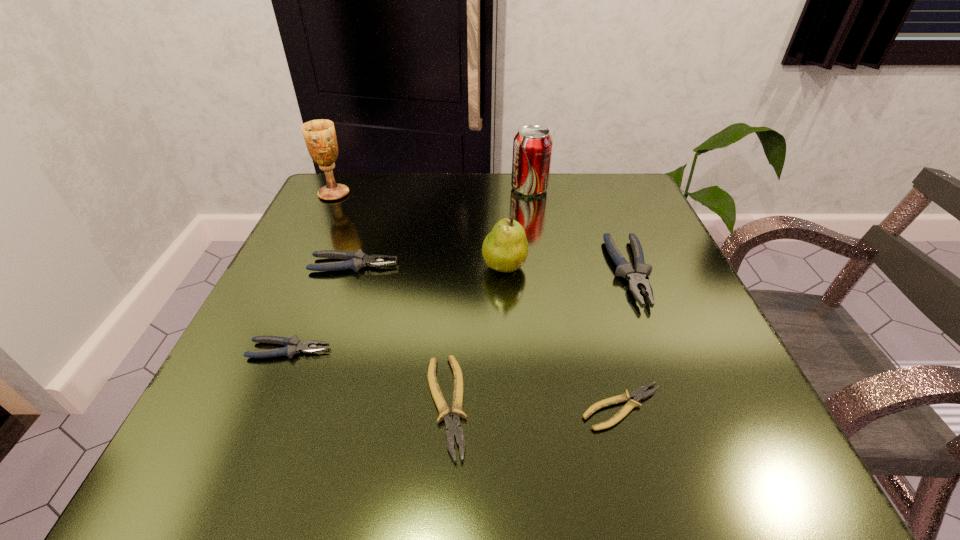
Find the location of a particular element. The image size is (960, 540). vacant area at the near left corner of the desktop is located at coordinates (173, 461).

Identify the location of vacant region at the far right corner of the desktop. (608, 174).

Where is `empty space that is in between the second smallest gray pliers and the second shortest object`? empty space that is in between the second smallest gray pliers and the second shortest object is located at coordinates pos(400,335).

Locate an element on the screen. free area in between the pear and the second shortest object is located at coordinates (475, 336).

Locate an element on the screen. empty space between the shortest object and the seventh tallest object is located at coordinates (534, 407).

Find the location of a particular element. This screenshot has height=540, width=960. free spot between the fourth tallest object and the soda can is located at coordinates (580, 230).

This screenshot has height=540, width=960. In order to click on free area in between the seventh tallest object and the seventh shortest object in this screenshot , I will do `click(488, 298)`.

Find the location of a particular element. This screenshot has height=540, width=960. vacant area between the nearest gray pliers and the second tallest pliers is located at coordinates (322, 307).

You are a GUI agent. You are given a task and a screenshot of the screen. Output one action in this format:
    pyautogui.click(x=<x>, y=<y>)
    Task: Click on the free space between the second tallest object and the chalice
    
    Given the screenshot: What is the action you would take?
    pyautogui.click(x=432, y=191)

Locate an element on the screen. Image resolution: width=960 pixels, height=540 pixels. the seventh closest object to the second shortest pliers is located at coordinates (320, 137).